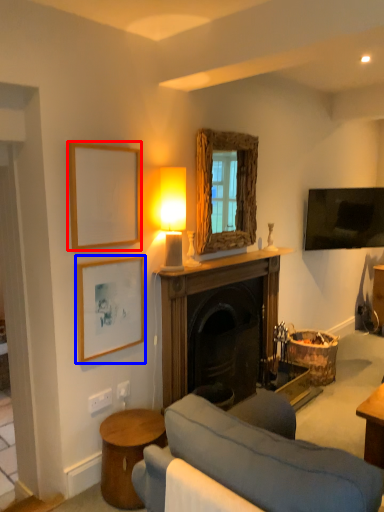
Question: Which point is closer to the camera, picture frame (highlighted by a red box) or picture frame (highlighted by a blue box)?

Choices:
 (A) picture frame
 (B) picture frame

Answer: (A)